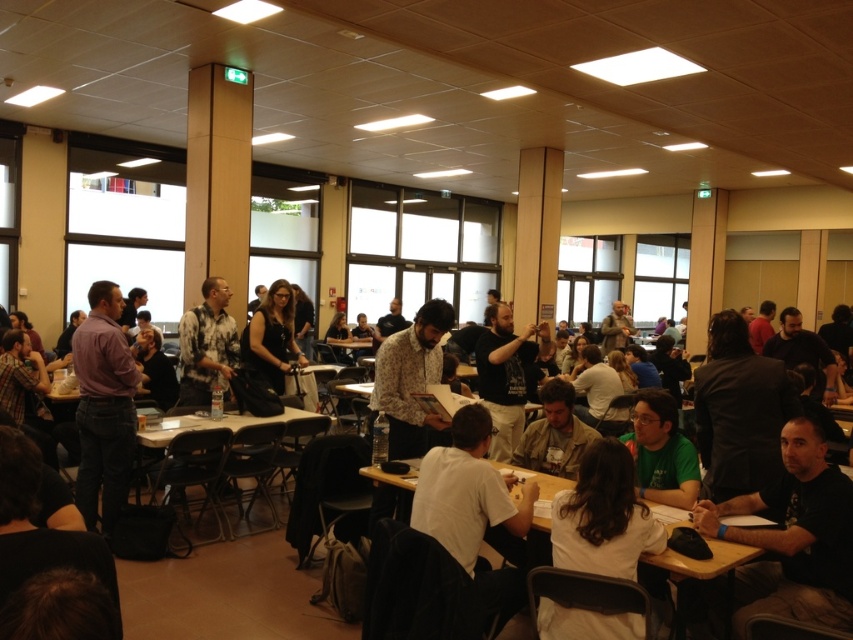
Measure the distance between wooden table at center and light brown wooden table at center.

wooden table at center is 6.94 feet away from light brown wooden table at center.

Is wooden table at center to the left of light brown wooden table at center from the viewer's perspective?

No, wooden table at center is not to the left of light brown wooden table at center.

Is point (722, 563) in front of point (149, 433)?

Yes, it is in front of point (149, 433).

Locate an element on the screen. wooden table at center is located at coordinates (709, 561).